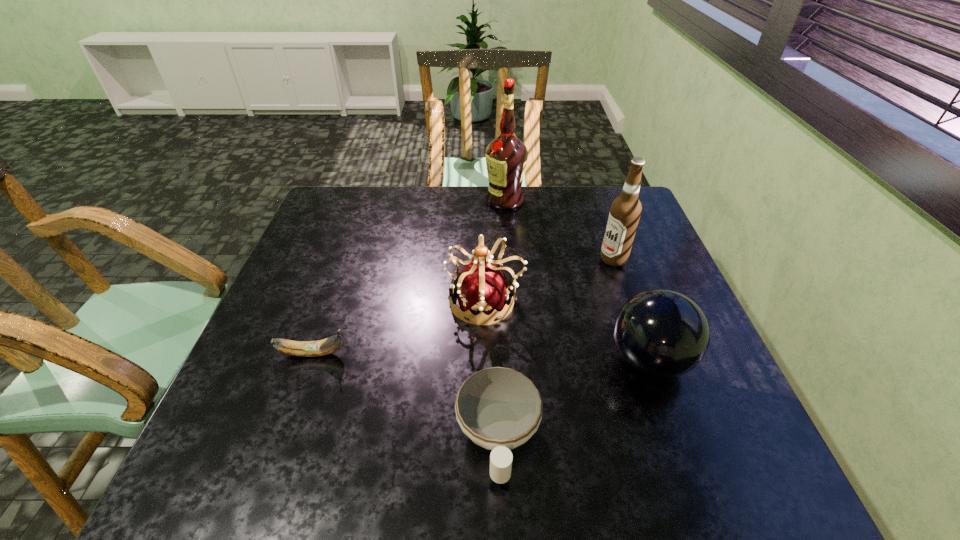
At what (x,y) coordinates should I click in order to perform the action: click on free location located 0.400m on the label of the farthest object. Please return your answer as a coordinate pair (x, y). This screenshot has height=540, width=960. Looking at the image, I should click on (363, 200).

Locate an element on the screen. The height and width of the screenshot is (540, 960). free space located 0.060m on the label of the fifth nearest object is located at coordinates (578, 259).

At what (x,y) coordinates should I click in order to perform the action: click on free spot located 0.240m on the label of the fifth nearest object. Please return your answer as a coordinate pair (x, y). Looking at the image, I should click on pos(513,259).

The height and width of the screenshot is (540, 960). Find the location of `free space located 0.400m on the label of the fifth nearest object`. free space located 0.400m on the label of the fifth nearest object is located at coordinates (455, 259).

Where is `free location located 0.070m on the front-facing side of the tiara`? This screenshot has height=540, width=960. free location located 0.070m on the front-facing side of the tiara is located at coordinates (x=418, y=301).

The height and width of the screenshot is (540, 960). Identify the location of vacant space located on the front-facing side of the tiara. (422, 301).

Locate an element on the screen. This screenshot has width=960, height=540. vacant space located on the front-facing side of the tiara is located at coordinates (298, 301).

What are the coordinates of `vacant region located 0.160m on the side of the bowling ball with the finger holes` in the screenshot? It's located at (535, 361).

Where is `vacant area situated 0.090m on the side of the bowling ball with the finger holes`? This screenshot has height=540, width=960. vacant area situated 0.090m on the side of the bowling ball with the finger holes is located at coordinates [566, 361].

Find the location of a particular element. Image resolution: width=960 pixels, height=540 pixels. blank area located on the side of the bowling ball with the finger holes is located at coordinates (553, 361).